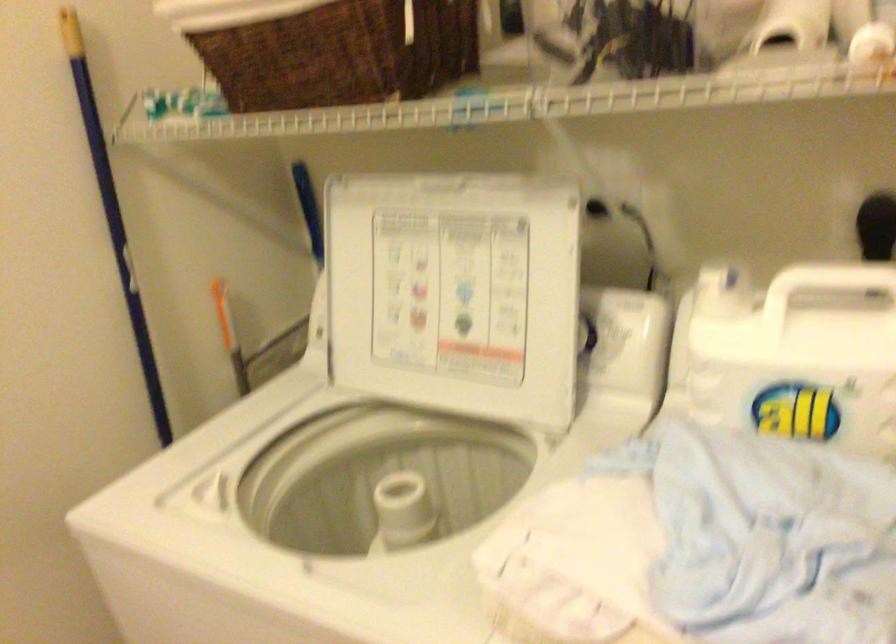
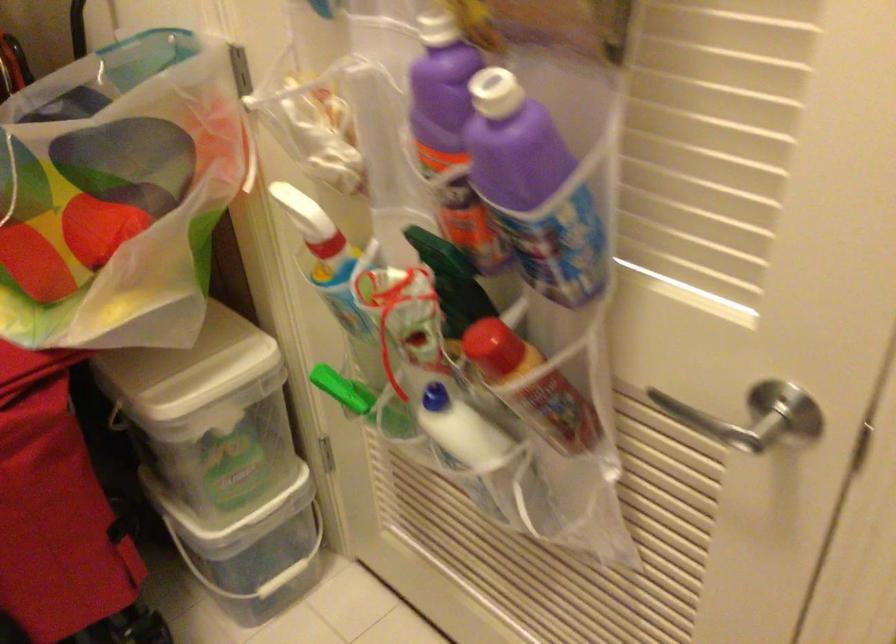
The images are taken continuously from a first-person perspective. In which direction is your viewpoint rotating?

The camera rotated toward left-down.